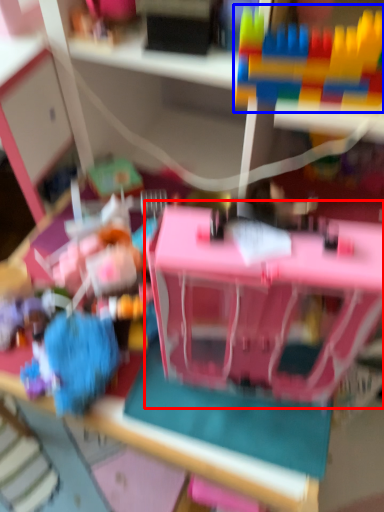
Question: Which point is further to the camera, toy (highlighted by a red box) or toy (highlighted by a blue box)?

Choices:
 (A) toy
 (B) toy

Answer: (B)